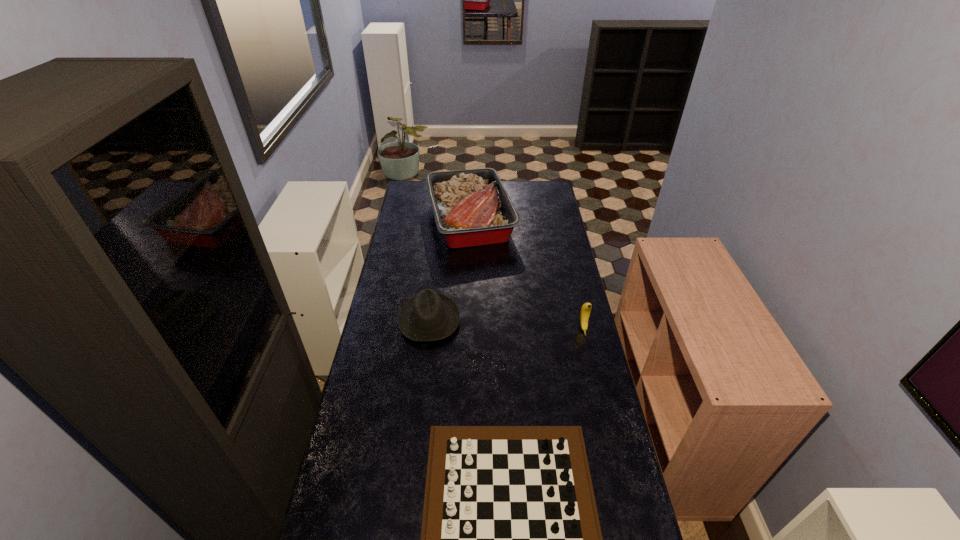
Find the location of a particular element. This screenshot has height=540, width=960. tray is located at coordinates (471, 207).

I want to click on banana, so click(x=586, y=308).

Where is `the second shortest object`? The width and height of the screenshot is (960, 540). the second shortest object is located at coordinates (430, 316).

This screenshot has height=540, width=960. What are the coordinates of `vacant region located on the front of the farthest object` in the screenshot? It's located at (468, 301).

Find the location of a particular element. The height and width of the screenshot is (540, 960). free space located from the stem of the banana is located at coordinates (602, 408).

Locate an element on the screen. vacant space situated on the back of the third tallest object is located at coordinates (438, 245).

This screenshot has height=540, width=960. Identify the location of object at the far edge. (471, 207).

This screenshot has width=960, height=540. In order to click on tray located at the left edge in this screenshot , I will do `click(471, 207)`.

At what (x,y) coordinates should I click in order to perform the action: click on fedora that is at the left edge. Please return your answer as a coordinate pair (x, y). Looking at the image, I should click on [430, 316].

Image resolution: width=960 pixels, height=540 pixels. I want to click on object that is positioned at the right edge, so click(x=586, y=308).